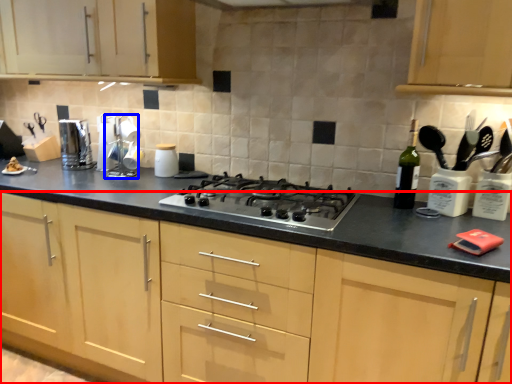
Question: Which of the following is the closest to the observer, cabinetry (highlighted by a red box) or appliance (highlighted by a blue box)?

Choices:
 (A) cabinetry
 (B) appliance

Answer: (A)